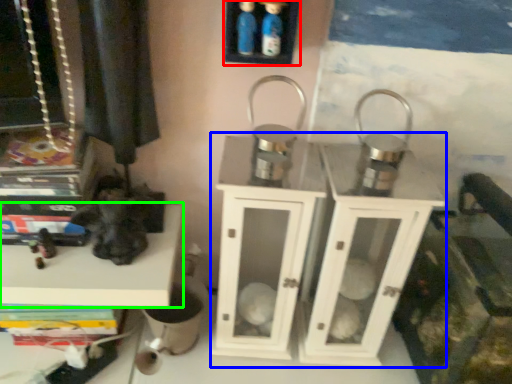
Question: Based on their relative distances, which object is farther from shelf (highlighted by a red box)? Choose from dresser (highlighted by a blue box) and shelf (highlighted by a green box).

Choices:
 (A) dresser
 (B) shelf

Answer: (B)